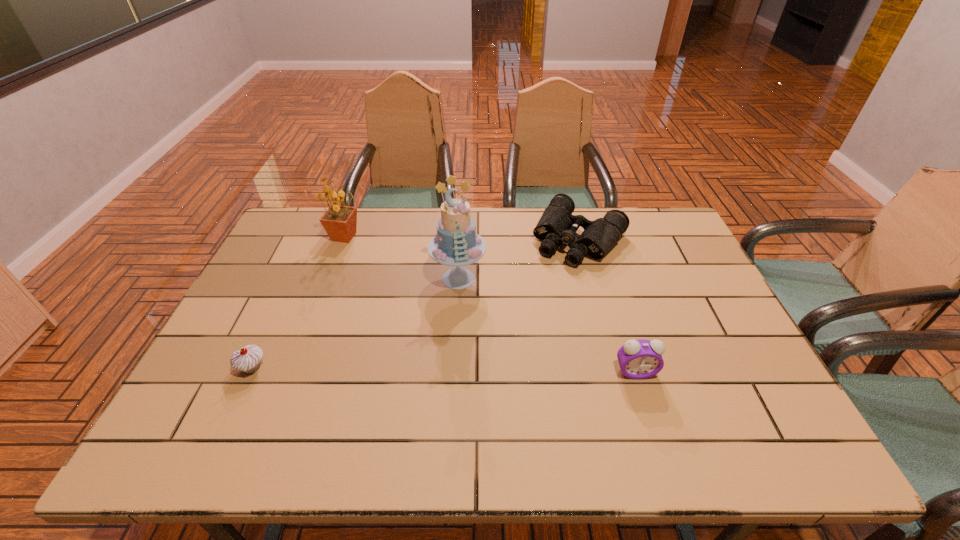
At what (x,y) coordinates should I click in order to perform the action: click on free space on the desktop that is between the cupcake and the alarm clock and is positioned with a ladder on the side of the third object from left to right. Please return your answer as a coordinate pair (x, y). This screenshot has height=540, width=960. Looking at the image, I should click on (404, 369).

Where is `free space on the desktop that is between the cupcake and the alarm clock and is positioned at the front of the fourth object from right to left with flowers visible`? The image size is (960, 540). free space on the desktop that is between the cupcake and the alarm clock and is positioned at the front of the fourth object from right to left with flowers visible is located at coordinates (447, 370).

At what (x,y) coordinates should I click in order to perform the action: click on free spot on the desktop that is between the leftmost object and the alarm clock and is positioned through the eyepieces of the shortest object. Please return your answer as a coordinate pair (x, y). Looking at the image, I should click on (486, 370).